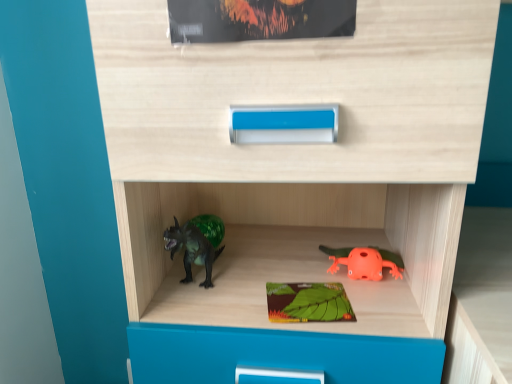
Question: Is matte green paperback book at upper center, arranged as the 2th paperback book when ordered from the bottom, facing away from orange matte frog at lower right?

Choices:
 (A) yes
 (B) no

Answer: (B)

Question: Is matte green paperback book at upper center, arranged as the 2th paperback book when ordered from the bottom, directly adjacent to orange matte frog at lower right?

Choices:
 (A) no
 (B) yes

Answer: (A)

Question: Is matte green paperback book at upper center, arranged as the 2th paperback book when ordered from the bottom, positioned beyond the bounds of orange matte frog at lower right?

Choices:
 (A) no
 (B) yes

Answer: (B)

Question: Is matte green paperback book at upper center, marked as the 2th paperback book in a back-to-front arrangement, shorter than orange matte frog at lower right?

Choices:
 (A) no
 (B) yes

Answer: (A)

Question: Can you confirm if matte green paperback book at upper center, marked as the 2th paperback book in a back-to-front arrangement, is wider than orange matte frog at lower right?

Choices:
 (A) yes
 (B) no

Answer: (B)

Question: Looking at the image, does orange matte frog at lower right seem bigger or smaller compared to green matte board game at center, which ranks as the 1th paperback book in bottom-to-top order?

Choices:
 (A) small
 (B) big

Answer: (B)

Question: From their relative heights in the image, would you say orange matte frog at lower right is taller or shorter than green matte board game at center, which ranks as the 1th paperback book in bottom-to-top order?

Choices:
 (A) short
 (B) tall

Answer: (B)

Question: Considering the relative positions of orange matte frog at lower right and green matte board game at center, which ranks as the 1th paperback book in bottom-to-top order, in the image provided, is orange matte frog at lower right to the left or to the right of green matte board game at center, which ranks as the 1th paperback book in bottom-to-top order,?

Choices:
 (A) left
 (B) right

Answer: (B)

Question: From the image's perspective, is orange matte frog at lower right above or below green matte board game at center, which ranks as the 1th paperback book in bottom-to-top order?

Choices:
 (A) above
 (B) below

Answer: (A)

Question: From the image's perspective, is matte green paperback book at upper center, marked as the 2th paperback book in a back-to-front arrangement, positioned above or below orange matte frog at lower right?

Choices:
 (A) above
 (B) below

Answer: (A)

Question: Would you say matte green paperback book at upper center, arranged as the 2th paperback book when ordered from the bottom, is inside or outside orange matte frog at lower right?

Choices:
 (A) outside
 (B) inside

Answer: (A)

Question: In terms of width, does matte green paperback book at upper center, the 1th paperback book viewed from the front, look wider or thinner when compared to orange matte frog at lower right?

Choices:
 (A) thin
 (B) wide

Answer: (A)

Question: From a real-world perspective, is matte green paperback book at upper center, arranged as the 2th paperback book when ordered from the bottom, physically located above or below orange matte frog at lower right?

Choices:
 (A) below
 (B) above

Answer: (B)

Question: Is green matte board game at center, which is counted as the 2th paperback book, starting from the top, inside or outside of matte green paperback book at upper center, marked as the 2th paperback book in a back-to-front arrangement?

Choices:
 (A) outside
 (B) inside

Answer: (A)

Question: Considering the relative positions of green matte board game at center, placed as the second paperback book when sorted from front to back, and matte green paperback book at upper center, marked as the 2th paperback book in a back-to-front arrangement, in the image provided, is green matte board game at center, placed as the second paperback book when sorted from front to back, to the left or to the right of matte green paperback book at upper center, marked as the 2th paperback book in a back-to-front arrangement,?

Choices:
 (A) left
 (B) right

Answer: (B)